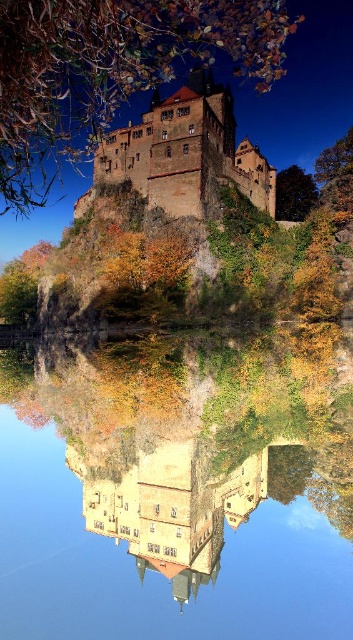
You are a painter standing at the base of the cliff, looking up at the scene. You want to paint the transparent glass water at center and the brown stone castle at upper center. Which object should you focus on first if you want to paint the larger one?

The transparent glass water at center has a larger size compared to the brown stone castle at upper center, so you should focus on painting the transparent glass water at center first.

You are a painter standing at the base of the cliff, looking up at the scene. You want to paint the transparent glass water at center and the brown stone castle at upper center. Which object appears larger in the painting?

The transparent glass water at center appears larger in the painting because it is much taller than the brown stone castle at upper center.